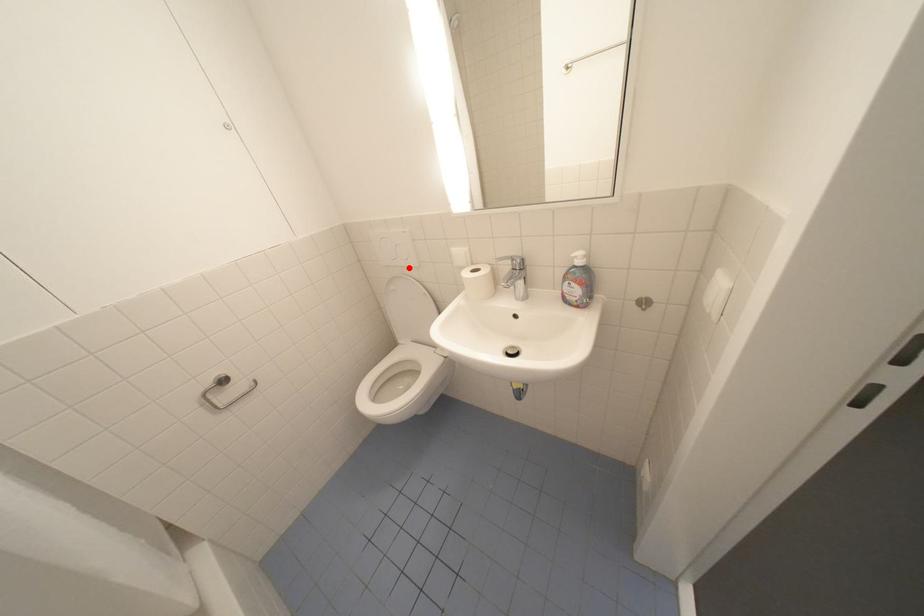
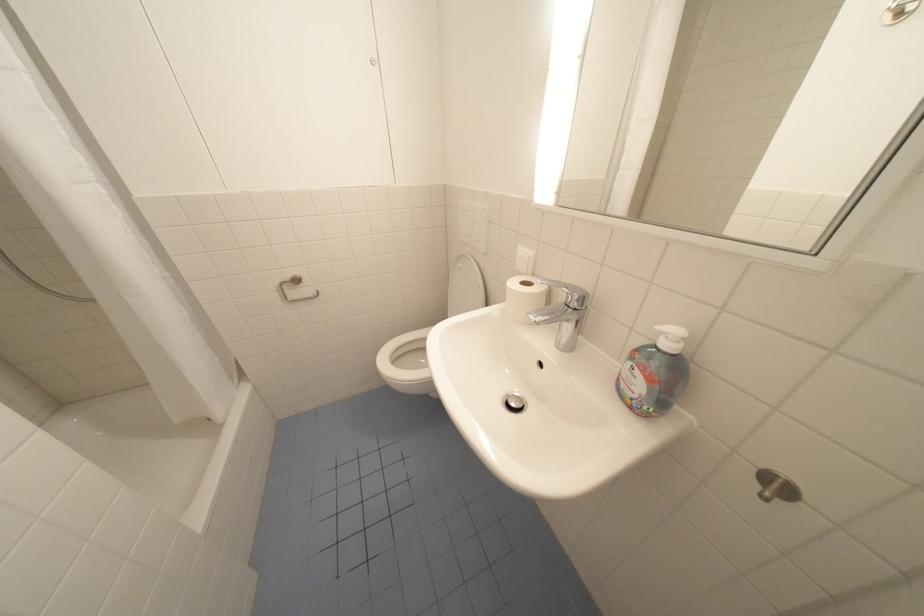
The point at the highlighted location is marked in the first image. Where is the corresponding point in the second image?

(480, 248)